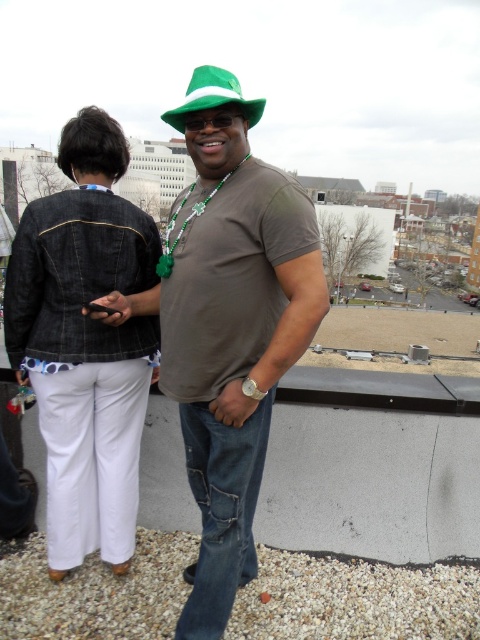
Question: Can you confirm if denim jacket at lower left is smaller than green felt fedora at center?

Choices:
 (A) yes
 (B) no

Answer: (A)

Question: Does green matte hat at center have a greater width compared to denim jacket at lower left?

Choices:
 (A) no
 (B) yes

Answer: (B)

Question: Among these objects, which one is farthest from the camera?

Choices:
 (A) green felt fedora at center
 (B) denim jacket at lower left
 (C) green matte hat at center

Answer: (B)

Question: Among these objects, which one is nearest to the camera?

Choices:
 (A) green felt fedora at center
 (B) denim jacket at lower left
 (C) green matte hat at center

Answer: (C)

Question: Can you confirm if green matte hat at center is positioned to the right of green felt fedora at center?

Choices:
 (A) no
 (B) yes

Answer: (B)

Question: Which of the following is the farthest from the observer?

Choices:
 (A) (43, 400)
 (B) (206, 102)

Answer: (A)